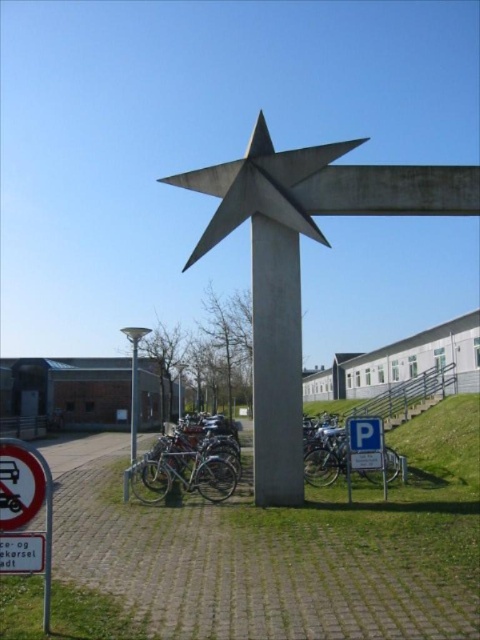
Is satin silver star at center above white plastic parking sign at lower right?

Correct, satin silver star at center is located above white plastic parking sign at lower right.

Can you confirm if satin silver star at center is wider than white plastic parking sign at lower right?

Yes.

Is point (211, 221) positioned behind point (348, 483)?

No, it is not.

You are a GUI agent. You are given a task and a screenshot of the screen. Output one action in this format:
    pyautogui.click(x=<x>, y=<y>)
    Task: Click on the satin silver star at center
    The width and height of the screenshot is (480, 640).
    Given the screenshot: What is the action you would take?
    pyautogui.click(x=259, y=186)

Is silver metallic bicycle at center closer to camera compared to white plastic parking sign at lower right?

No, it is behind white plastic parking sign at lower right.

Locate an element on the screen. This screenshot has height=640, width=480. silver metallic bicycle at center is located at coordinates (188, 467).

Does point (223, 481) lie in front of point (350, 456)?

No, it is behind (350, 456).

Find the location of a particular element. silver metallic bicycle at center is located at coordinates (188, 467).

Does white plastic parking sign at lower right appear on the left side of gray metal sign at lower left?

Incorrect, white plastic parking sign at lower right is not on the left side of gray metal sign at lower left.

Which is more to the left, white plastic parking sign at lower right or gray metal sign at lower left?

gray metal sign at lower left

Who is more distant from viewer, (351, 454) or (28, 541)?

Positioned behind is point (351, 454).

The height and width of the screenshot is (640, 480). Find the location of `white plastic parking sign at lower right`. white plastic parking sign at lower right is located at coordinates (364, 449).